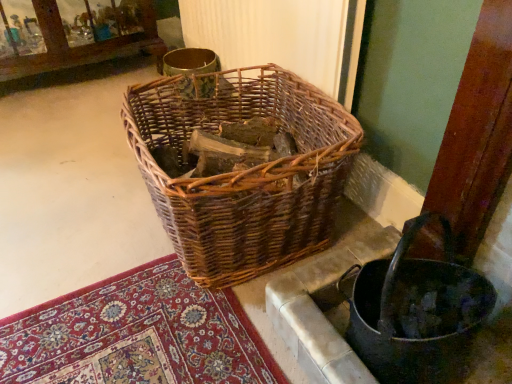
Question: Should I look upward or downward to see woven wood basket at lower right?

Choices:
 (A) down
 (B) up

Answer: (A)

Question: Considering the relative sizes of woven wood basket at lower right and woven brown basket at center in the image provided, is woven wood basket at lower right wider than woven brown basket at center?

Choices:
 (A) no
 (B) yes

Answer: (A)

Question: Does woven wood basket at lower right have a lesser width compared to woven brown basket at center?

Choices:
 (A) yes
 (B) no

Answer: (A)

Question: Is woven wood basket at lower right facing away from woven brown basket at center?

Choices:
 (A) no
 (B) yes

Answer: (A)

Question: Is woven wood basket at lower right in contact with woven brown basket at center?

Choices:
 (A) no
 (B) yes

Answer: (A)

Question: From the image's perspective, is woven wood basket at lower right beneath woven brown basket at center?

Choices:
 (A) yes
 (B) no

Answer: (A)

Question: From the image's perspective, is woven wood basket at lower right located above woven brown basket at center?

Choices:
 (A) yes
 (B) no

Answer: (B)

Question: Can you confirm if woven brown basket at center is bigger than woven wood basket at lower right?

Choices:
 (A) yes
 (B) no

Answer: (A)

Question: Can you confirm if woven brown basket at center is smaller than woven wood basket at lower right?

Choices:
 (A) no
 (B) yes

Answer: (A)

Question: Can you confirm if woven brown basket at center is taller than woven wood basket at lower right?

Choices:
 (A) yes
 (B) no

Answer: (A)

Question: Considering the relative positions of woven brown basket at center and woven wood basket at lower right in the image provided, is woven brown basket at center to the left of woven wood basket at lower right from the viewer's perspective?

Choices:
 (A) yes
 (B) no

Answer: (A)

Question: Is woven brown basket at center not within woven wood basket at lower right?

Choices:
 (A) yes
 (B) no

Answer: (A)

Question: From a real-world perspective, is woven brown basket at center physically above woven wood basket at lower right?

Choices:
 (A) no
 (B) yes

Answer: (B)

Question: From a real-world perspective, is woven wood basket at lower right physically located above or below woven brown basket at center?

Choices:
 (A) above
 (B) below

Answer: (B)